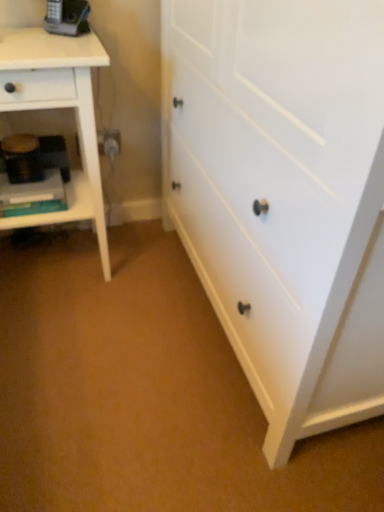
This screenshot has width=384, height=512. I want to click on free space in front of white wood nightstand at left, so (x=63, y=334).